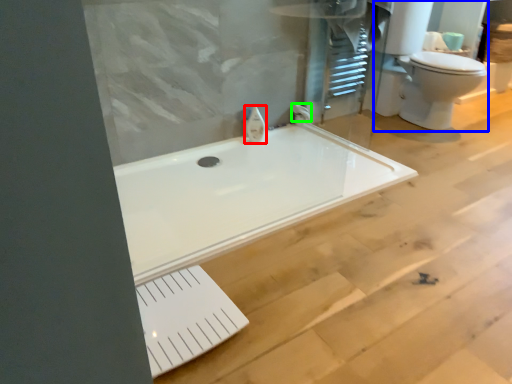
Question: Which object is the closest to the faucet (highlighted by a red box)? Choose among these: sink (highlighted by a blue box) or faucet (highlighted by a green box).

Choices:
 (A) sink
 (B) faucet

Answer: (B)